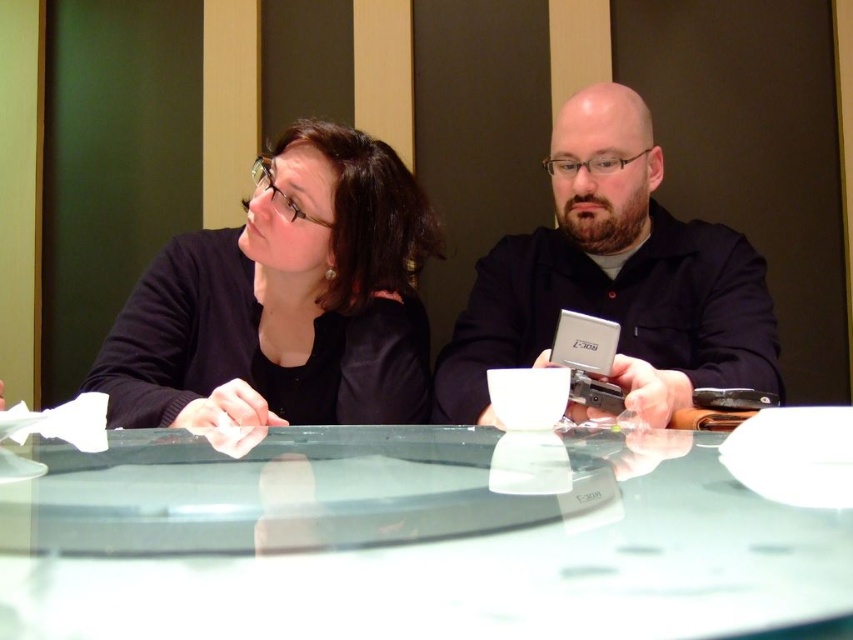
Does transparent glass table at center appear on the right side of black matte laptop at center?

No, transparent glass table at center is not to the right of black matte laptop at center.

Does transparent glass table at center have a lesser height compared to black matte laptop at center?

Indeed, transparent glass table at center has a lesser height compared to black matte laptop at center.

Find the location of a particular element. The height and width of the screenshot is (640, 853). transparent glass table at center is located at coordinates (405, 541).

Which is above, black matte sweater at upper left or matte black shirt at center?

Positioned higher is matte black shirt at center.

Consider the image. Does black matte sweater at upper left have a lesser width compared to matte black shirt at center?

Correct, black matte sweater at upper left's width is less than matte black shirt at center's.

Does point (288, 168) come closer to viewer compared to point (610, 308)?

Yes.

I want to click on black matte sweater at upper left, so click(x=285, y=300).

Between point (271, 563) and point (566, 236), which one is positioned in front?

Point (271, 563) is more forward.

Is transparent glass table at center taller than matte black shirt at center?

In fact, transparent glass table at center may be shorter than matte black shirt at center.

Between point (409, 513) and point (585, 232), which one is positioned in front?

Positioned in front is point (409, 513).

What are the coordinates of `transparent glass table at center` in the screenshot? It's located at (405, 541).